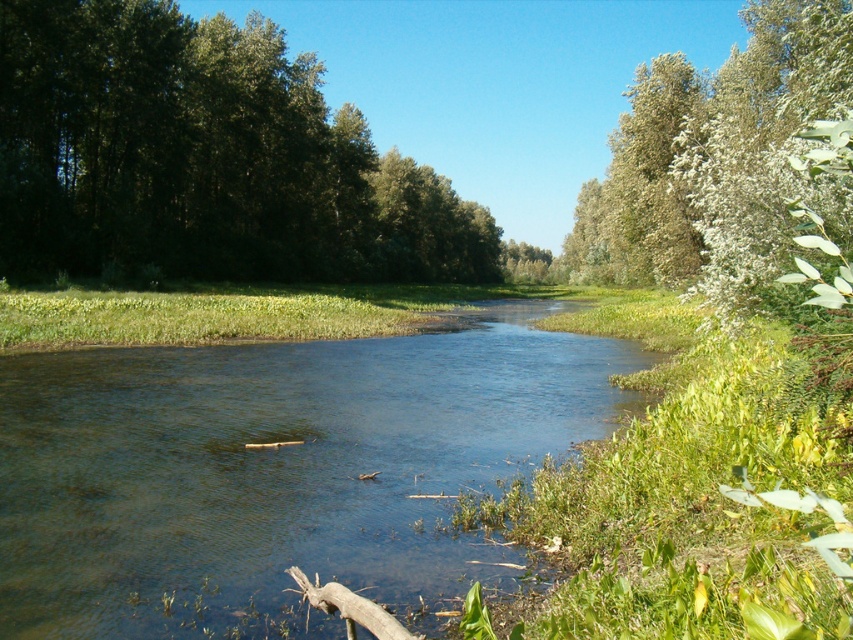
Does clear water at center have a greater width compared to green leafy trees at left?

No.

Find the location of `clear water at center`. clear water at center is located at coordinates (277, 468).

Is point (68, 464) less distant than point (183, 157)?

That is True.

Where is `clear water at center`? The image size is (853, 640). clear water at center is located at coordinates (277, 468).

Does green leafy trees at left come behind green fuzzy bush at upper right?

Yes, it is.

Image resolution: width=853 pixels, height=640 pixels. What do you see at coordinates (204, 157) in the screenshot?
I see `green leafy trees at left` at bounding box center [204, 157].

Identify the location of green leafy trees at left. (204, 157).

Does clear water at center appear under green fuzzy bush at upper right?

Yes, clear water at center is below green fuzzy bush at upper right.

Is point (430, 349) positioned in front of point (645, 259)?

Yes, point (430, 349) is closer to viewer.

Describe the element at coordinates (277, 468) in the screenshot. I see `clear water at center` at that location.

The width and height of the screenshot is (853, 640). I want to click on clear water at center, so click(277, 468).